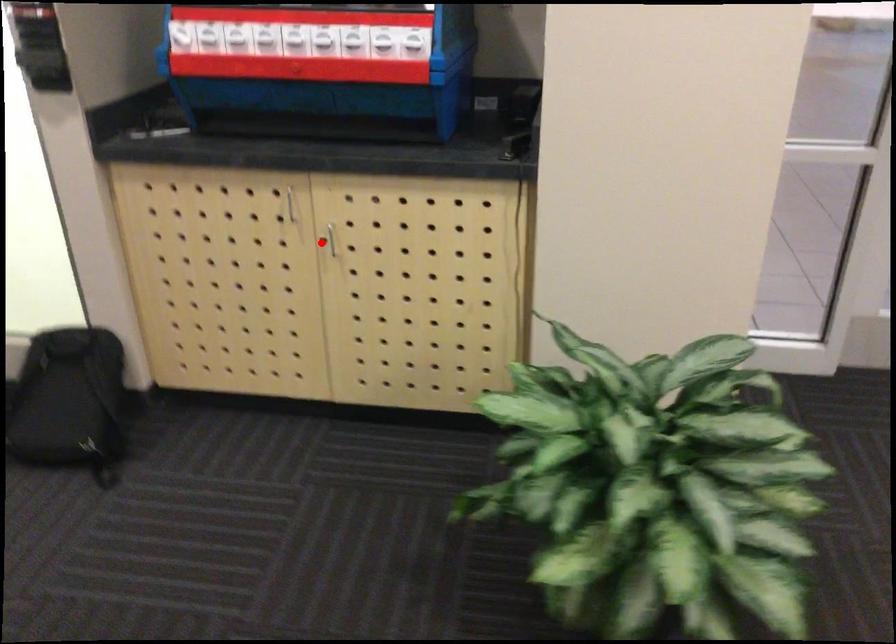
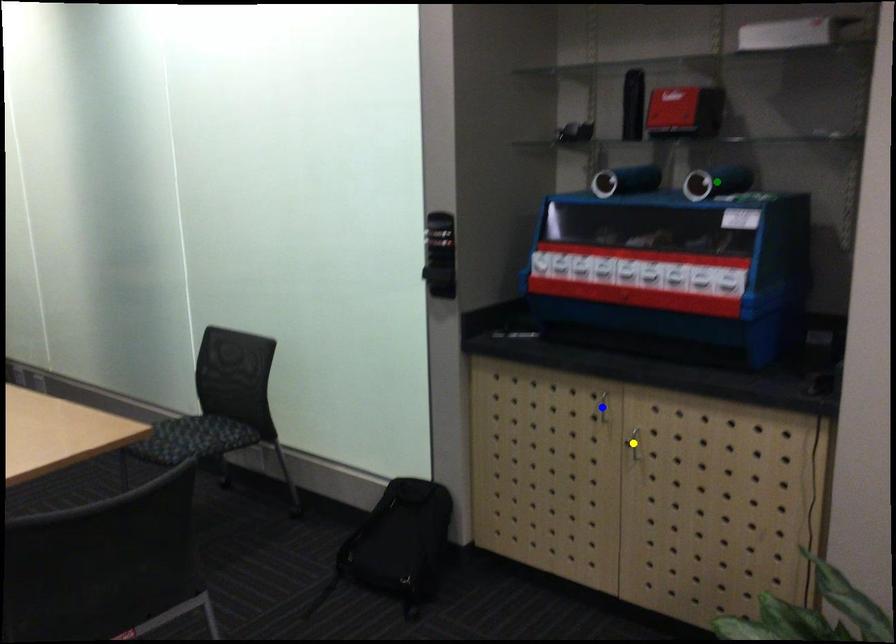
Question: I am providing you with two images of the same scene from different viewpoints. A red point is marked on the first image. You are given multiple points on the second image. Which mark in image 2 goes with the point in image 1?

Choices:
 (A) yellow point
 (B) green point
 (C) blue point

Answer: (A)